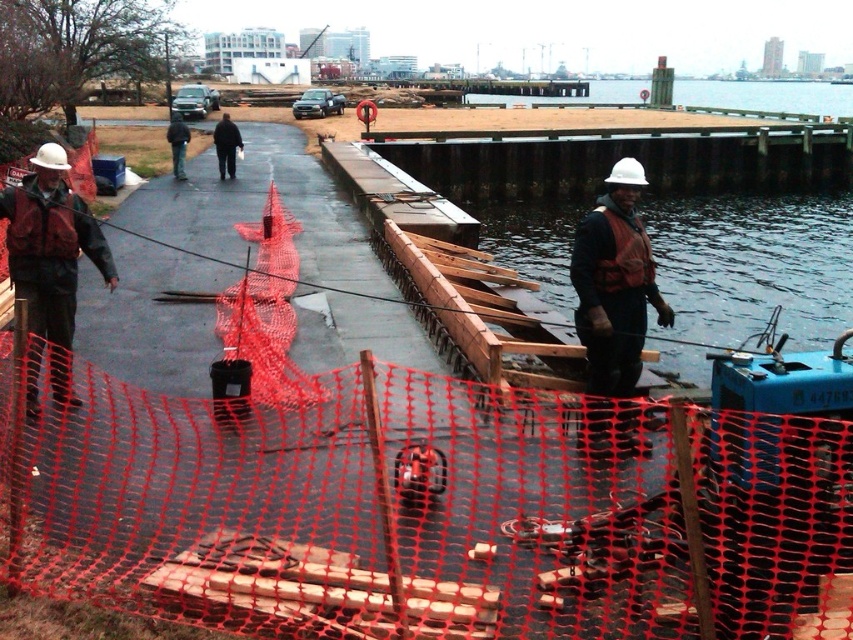
Question: Is the position of white hard hat at center less distant than that of matte black jacket at left?

Choices:
 (A) no
 (B) yes

Answer: (B)

Question: Does white hard hat at center come in front of matte black jacket at left?

Choices:
 (A) no
 (B) yes

Answer: (B)

Question: Which point appears farthest from the camera in this image?

Choices:
 (A) (611, 340)
 (B) (35, 326)

Answer: (B)

Question: Can you confirm if white hard hat at center is positioned below matte black jacket at left?

Choices:
 (A) no
 (B) yes

Answer: (B)

Question: Which point is farther to the camera?

Choices:
 (A) white hard hat at center
 (B) matte black jacket at left

Answer: (B)

Question: Among these points, which one is farthest from the camera?

Choices:
 (A) (57, 243)
 (B) (633, 202)

Answer: (A)